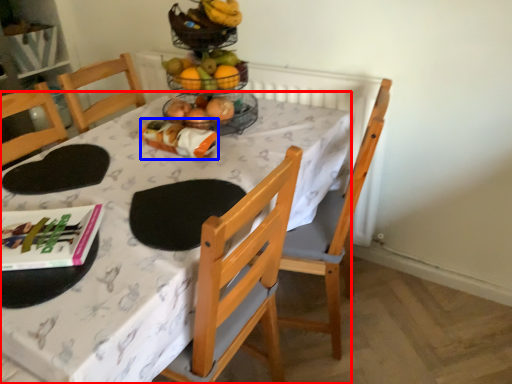
Question: Which of the following is the farthest to the observer, desk (highlighted by a red box) or food (highlighted by a blue box)?

Choices:
 (A) desk
 (B) food

Answer: (B)